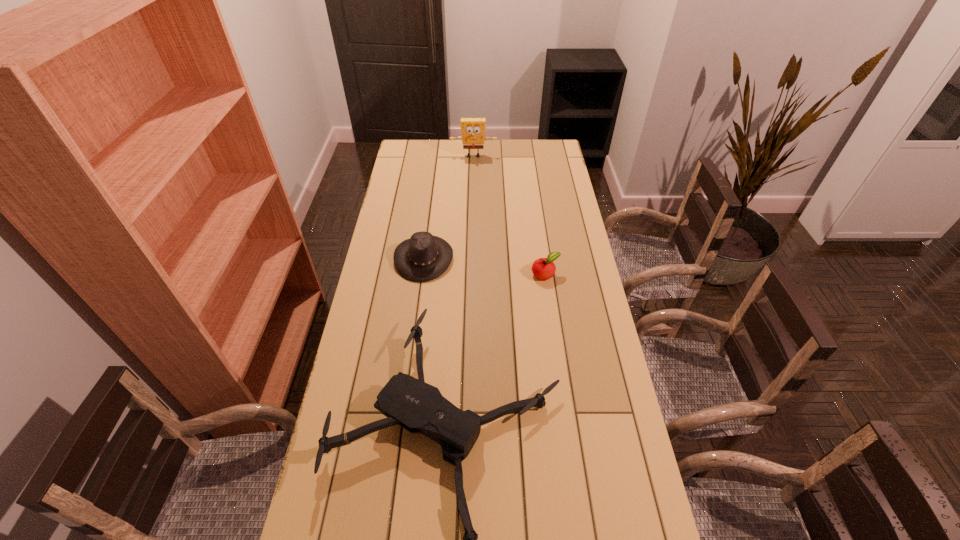
Identify the location of the tallest object. The image size is (960, 540). (473, 129).

Find the location of a particular element. The height and width of the screenshot is (540, 960). the farthest object is located at coordinates (473, 129).

This screenshot has width=960, height=540. I want to click on hat, so click(x=424, y=257).

Locate an element on the screen. The width and height of the screenshot is (960, 540). apple is located at coordinates (543, 268).

Identify the location of vacant region located on the face of the farthest object. This screenshot has width=960, height=540. (473, 166).

Identify the location of free region located 0.080m on the front-facing side of the hat. (474, 258).

Where is `free region located on the left of the shortest object`? The width and height of the screenshot is (960, 540). free region located on the left of the shortest object is located at coordinates (434, 274).

Find the location of a particular element. object that is at the far edge is located at coordinates (473, 129).

This screenshot has width=960, height=540. Find the location of `object that is at the left edge`. object that is at the left edge is located at coordinates (424, 257).

Where is `object positioned at the right edge`? Image resolution: width=960 pixels, height=540 pixels. object positioned at the right edge is located at coordinates (543, 268).